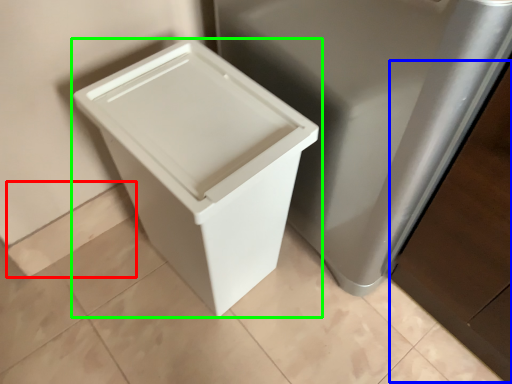
Question: Estimate the real-world distances between objects in this image. Which object is closer to square (highlighted by a red box), cabinetry (highlighted by a blue box) or waste container (highlighted by a green box)?

Choices:
 (A) cabinetry
 (B) waste container

Answer: (B)